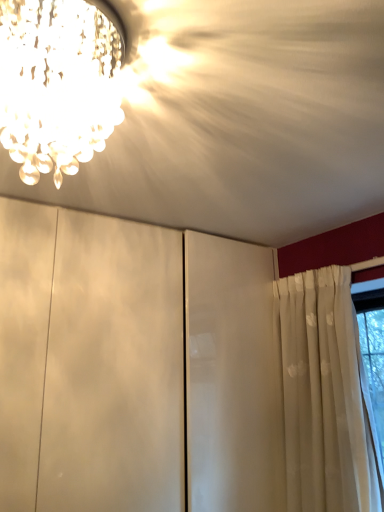
Question: Would you say crystal chandelier at upper left is inside or outside white matte cabinet at center?

Choices:
 (A) outside
 (B) inside

Answer: (A)

Question: Considering the positions of point (86, 92) and point (248, 38), is point (86, 92) closer or farther from the camera than point (248, 38)?

Choices:
 (A) farther
 (B) closer

Answer: (B)

Question: Is crystal chandelier at upper left to the left or to the right of white matte cabinet at center in the image?

Choices:
 (A) left
 (B) right

Answer: (A)

Question: Is white matte cabinet at center inside or outside of crystal chandelier at upper left?

Choices:
 (A) inside
 (B) outside

Answer: (B)

Question: Would you say white matte cabinet at center is to the left or to the right of crystal chandelier at upper left in the picture?

Choices:
 (A) left
 (B) right

Answer: (B)

Question: In terms of size, does white matte cabinet at center appear bigger or smaller than crystal chandelier at upper left?

Choices:
 (A) big
 (B) small

Answer: (A)

Question: From a real-world perspective, is white matte cabinet at center above or below crystal chandelier at upper left?

Choices:
 (A) above
 (B) below

Answer: (A)